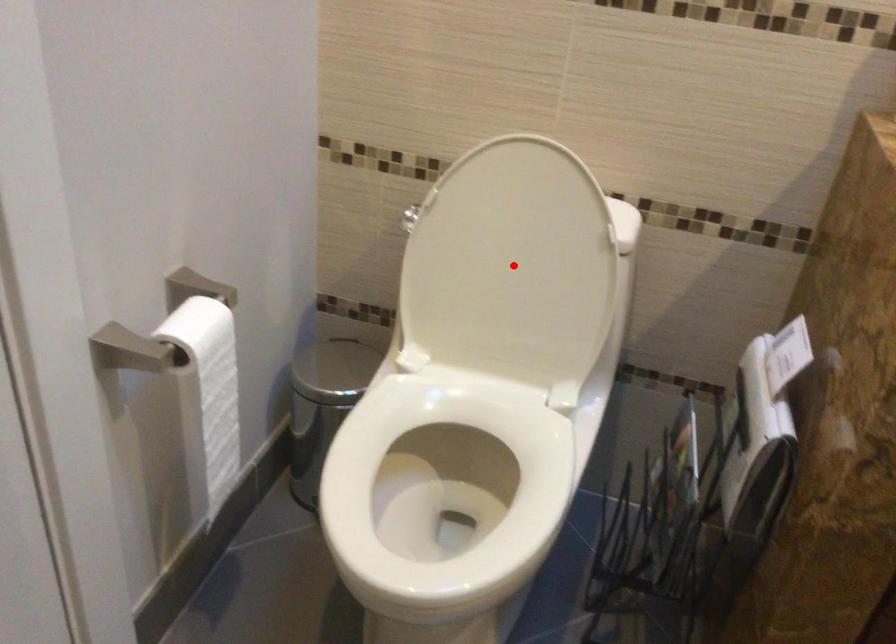
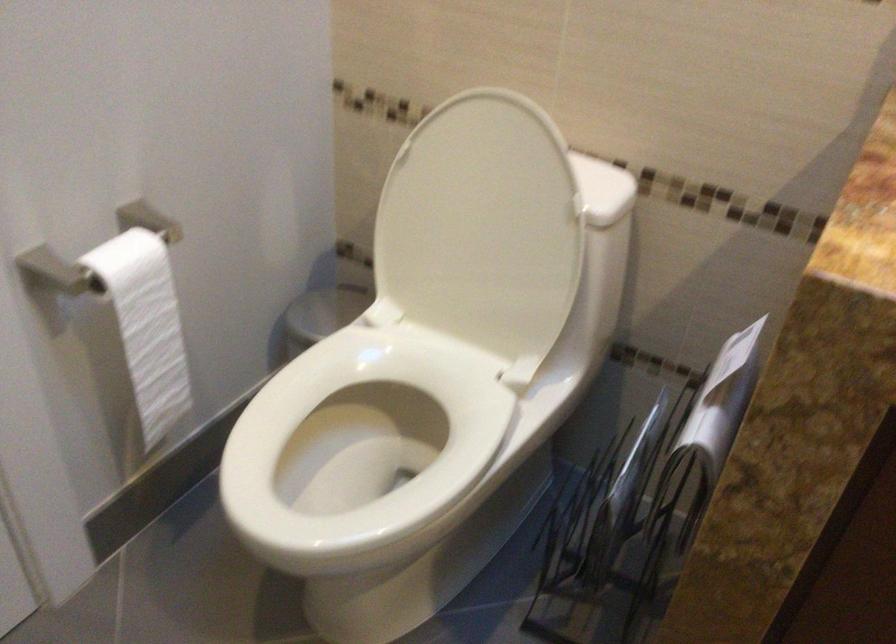
Find the pixel in the second image that matches the highlighted location in the first image.

(483, 228)